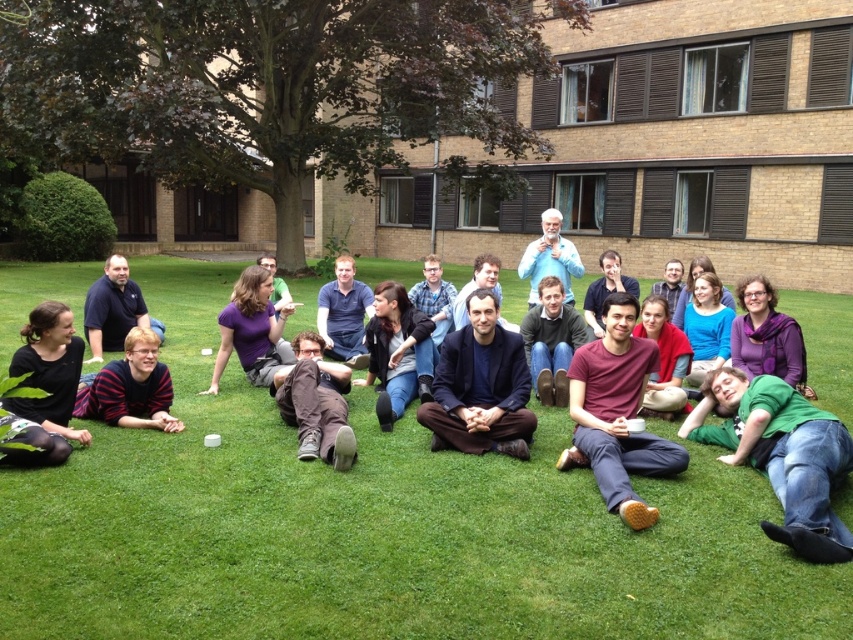
Describe the element at coordinates (376, 529) in the screenshot. Image resolution: width=853 pixels, height=640 pixels. I see `green grass at center` at that location.

Can you confirm if green grass at center is smaller than dark brown hair at center?

No.

Which is in front, point (96, 579) or point (399, 384)?

Positioned in front is point (96, 579).

Locate an element on the screen. This screenshot has height=640, width=853. green grass at center is located at coordinates (376, 529).

How much distance is there between green grass at center and blue cotton shirt at center?

green grass at center is 3.98 meters away from blue cotton shirt at center.

What do you see at coordinates (376, 529) in the screenshot? I see `green grass at center` at bounding box center [376, 529].

This screenshot has height=640, width=853. In order to click on green grass at center in this screenshot , I will do `click(376, 529)`.

Is dark brown hair at center smaller than blue cotton shirt at center?

Indeed, dark brown hair at center has a smaller size compared to blue cotton shirt at center.

Between dark brown hair at center and blue cotton shirt at center, which one has more height?

Standing taller between the two is blue cotton shirt at center.

Which is in front, point (376, 300) or point (525, 266)?

Point (376, 300)

This screenshot has width=853, height=640. Find the location of `dark brown hair at center`. dark brown hair at center is located at coordinates (393, 349).